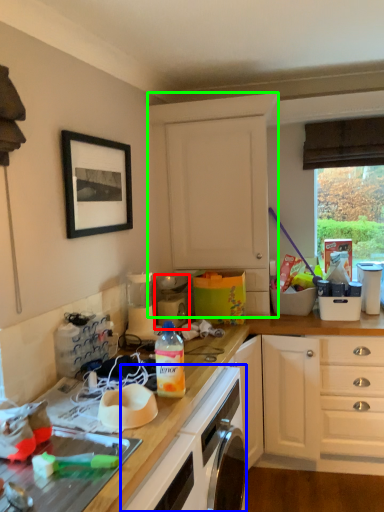
Question: Based on their relative distances, which object is farther from appliance (highlighted by a red box)? Choose from oven (highlighted by a blue box) and cabinetry (highlighted by a green box).

Choices:
 (A) oven
 (B) cabinetry

Answer: (A)